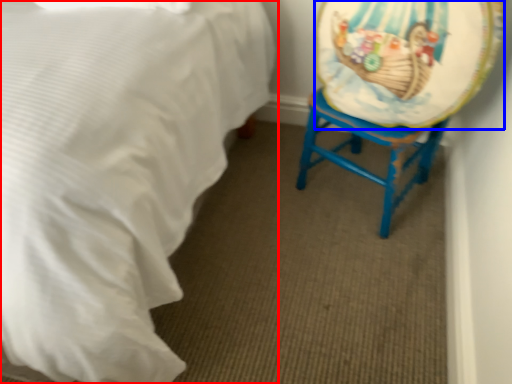
Question: Which object appears farthest to the camera in this image, bed (highlighted by a red box) or platter (highlighted by a blue box)?

Choices:
 (A) bed
 (B) platter

Answer: (B)